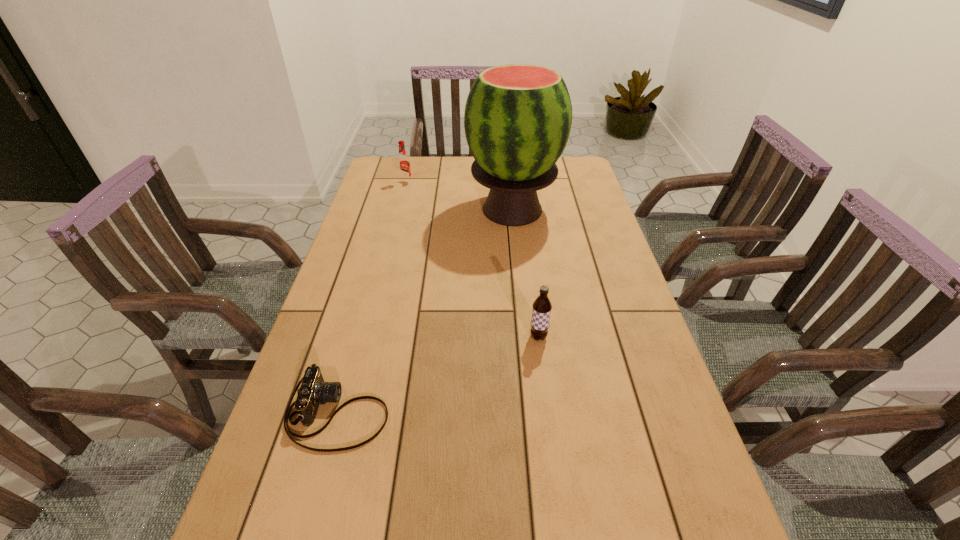
You are a GUI agent. You are given a task and a screenshot of the screen. Output one action in this format:
    pyautogui.click(x=<x>, y=<y>)
    Task: Click on the third nearest object
    The image size is (960, 540).
    Given the screenshot: What is the action you would take?
    pyautogui.click(x=517, y=120)

Identify the location of watermelon. (517, 120).

Where is `the farther root beer`? This screenshot has width=960, height=540. the farther root beer is located at coordinates (404, 169).

This screenshot has width=960, height=540. What are the coordinates of `the farthest object` in the screenshot? It's located at (404, 169).

Locate an element on the screen. the right root beer is located at coordinates (541, 311).

Find the location of `the nearer root beer`. the nearer root beer is located at coordinates (541, 311).

In order to click on camera in this screenshot , I will do `click(313, 391)`.

The height and width of the screenshot is (540, 960). I want to click on the shortest object, so click(313, 391).

At what (x,y) coordinates should I click in order to perform the action: click on vacant area situated on the left of the tallest object. Please return your answer as a coordinate pair (x, y). Image resolution: width=960 pixels, height=540 pixels. Looking at the image, I should click on (412, 210).

Find the location of `vacant space located 0.090m on the left of the farthest object`. vacant space located 0.090m on the left of the farthest object is located at coordinates (376, 183).